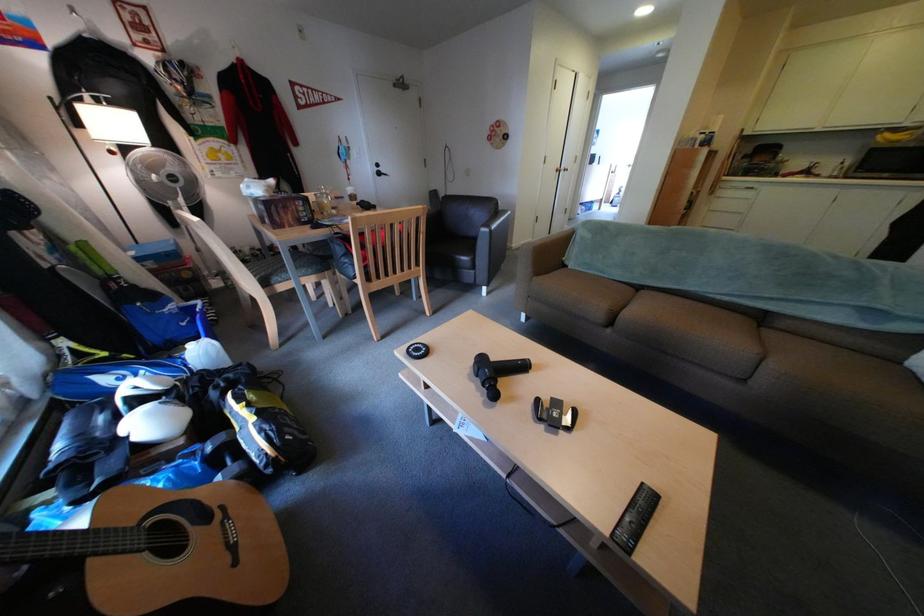
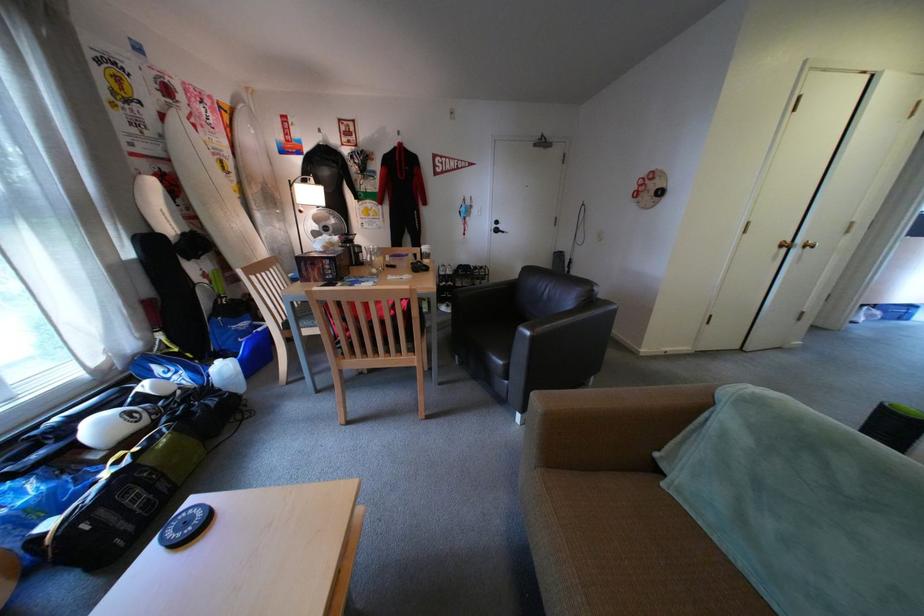
Where in the second image is the point corresponding to the point at 505,233 from the first image?

(545, 339)